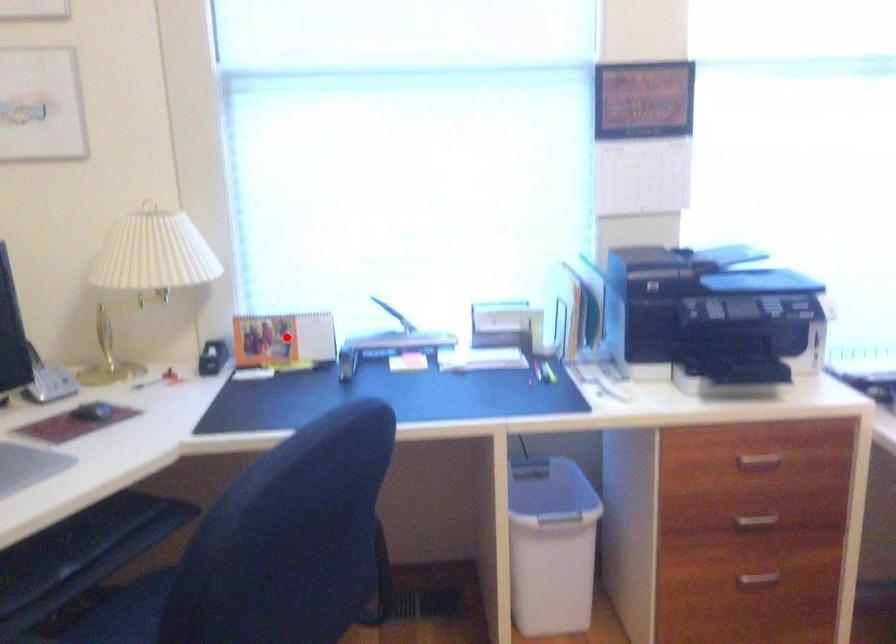
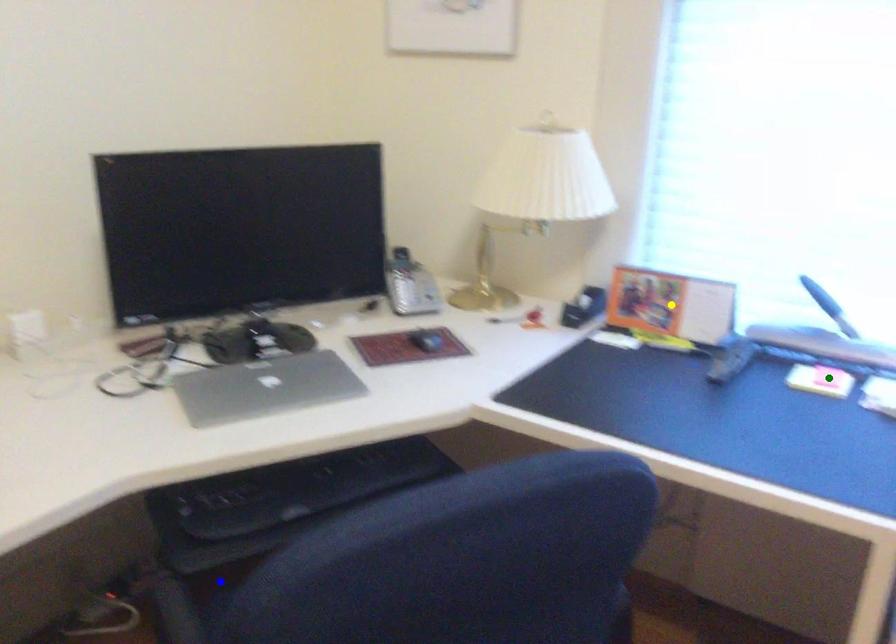
Question: I am providing you with two images of the same scene from different viewpoints. A red point is marked on the first image. You are given multiple points on the second image. In image 2, which mark is for the same physical point as the one in image 1?

Choices:
 (A) blue point
 (B) green point
 (C) yellow point

Answer: (C)